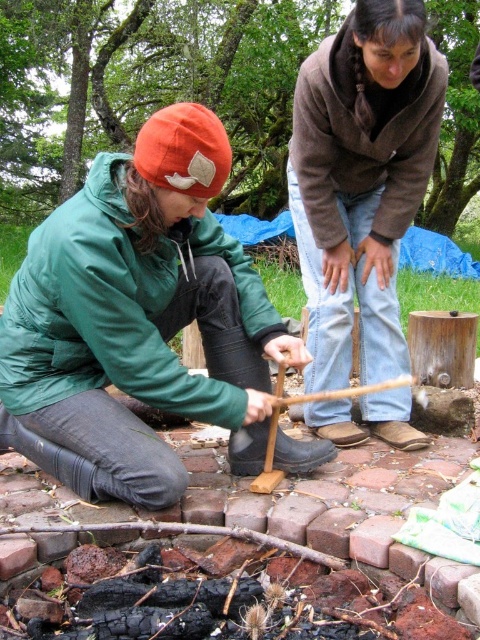
Question: Which point is closer to the camera?

Choices:
 (A) (82, 205)
 (B) (309, 170)

Answer: (A)

Question: Is matte green jacket at center further to the viewer compared to brown fuzzy sweater at upper center?

Choices:
 (A) yes
 (B) no

Answer: (B)

Question: Does matte green jacket at center appear on the right side of brown fuzzy sweater at upper center?

Choices:
 (A) yes
 (B) no

Answer: (B)

Question: Which point is closer to the camera?

Choices:
 (A) (374, 256)
 (B) (132, 417)

Answer: (B)

Question: Among these objects, which one is nearest to the camera?

Choices:
 (A) matte green jacket at center
 (B) brown fuzzy sweater at upper center

Answer: (A)

Question: In this image, where is matte green jacket at center located relative to brown fuzzy sweater at upper center?

Choices:
 (A) left
 (B) right

Answer: (A)